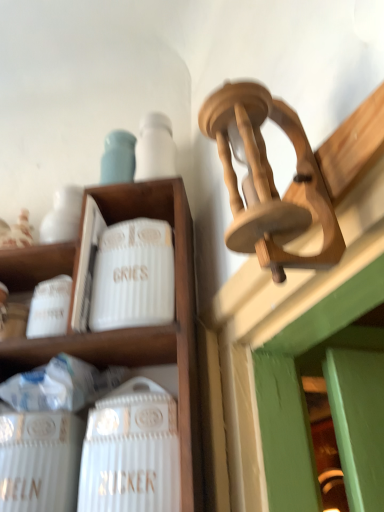
Question: Is white ribbed ceramic canister at center-left wider than white ceramic wine bottle at lower left?

Choices:
 (A) yes
 (B) no

Answer: (A)

Question: Could you tell me if white ribbed ceramic canister at center-left is facing white ceramic wine bottle at lower left?

Choices:
 (A) yes
 (B) no

Answer: (B)

Question: Considering the relative sizes of white ribbed ceramic canister at center-left and white ceramic wine bottle at lower left in the image provided, is white ribbed ceramic canister at center-left smaller than white ceramic wine bottle at lower left?

Choices:
 (A) yes
 (B) no

Answer: (A)

Question: Does white ribbed ceramic canister at center-left have a greater height compared to white ceramic wine bottle at lower left?

Choices:
 (A) no
 (B) yes

Answer: (A)

Question: Considering the relative positions of white ribbed ceramic canister at center-left and white ceramic wine bottle at lower left in the image provided, is white ribbed ceramic canister at center-left to the right of white ceramic wine bottle at lower left from the viewer's perspective?

Choices:
 (A) no
 (B) yes

Answer: (A)

Question: Is white ribbed ceramic canister at center-left taller or shorter than white ceramic canister at upper left?

Choices:
 (A) tall
 (B) short

Answer: (B)

Question: Which is correct: white ribbed ceramic canister at center-left is inside white ceramic canister at upper left, or outside of it?

Choices:
 (A) outside
 (B) inside

Answer: (B)

Question: Does point (155, 316) appear closer or farther from the camera than point (162, 201)?

Choices:
 (A) farther
 (B) closer

Answer: (B)

Question: From the image's perspective, is white ribbed ceramic canister at center-left above or below white ceramic canister at upper left?

Choices:
 (A) above
 (B) below

Answer: (A)

Question: Considering the relative positions of white ceramic canister at upper left and white ribbed ceramic canister at center-left in the image provided, is white ceramic canister at upper left to the left or to the right of white ribbed ceramic canister at center-left?

Choices:
 (A) right
 (B) left

Answer: (B)

Question: Relative to white ribbed ceramic canister at center-left, is white ceramic canister at upper left in front or behind?

Choices:
 (A) behind
 (B) front

Answer: (B)

Question: Which is correct: white ceramic canister at upper left is inside white ribbed ceramic canister at center-left, or outside of it?

Choices:
 (A) outside
 (B) inside

Answer: (A)

Question: Considering the positions of point (195, 365) and point (127, 225), is point (195, 365) closer or farther from the camera than point (127, 225)?

Choices:
 (A) farther
 (B) closer

Answer: (B)

Question: Is white ceramic wine bottle at lower left wider or thinner than white ceramic canister at upper left?

Choices:
 (A) thin
 (B) wide

Answer: (A)

Question: From a real-world perspective, is white ceramic wine bottle at lower left positioned above or below white ceramic canister at upper left?

Choices:
 (A) above
 (B) below

Answer: (B)